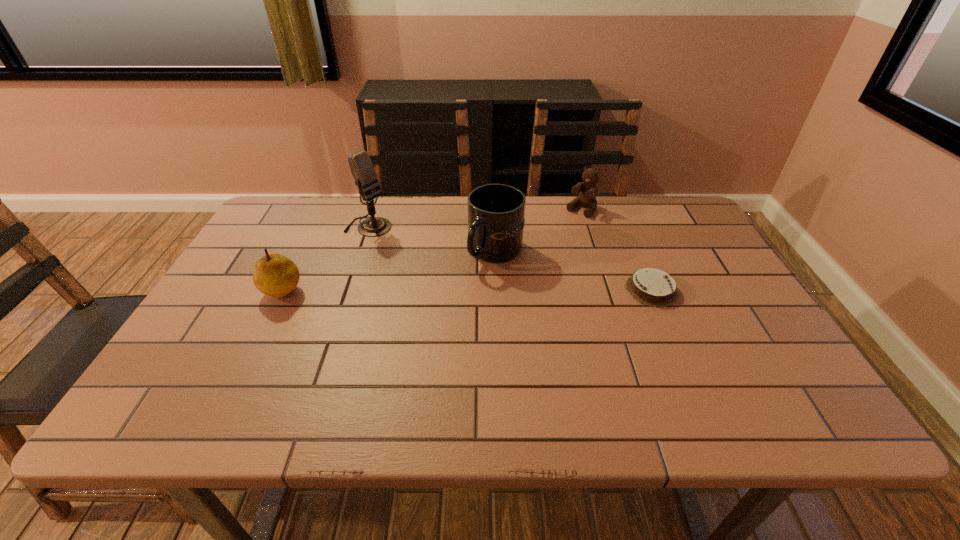
Find the location of a particular element. This screenshot has height=540, width=960. vacant space on the desktop that is between the leftmost object and the shortest object and is positioned with the handle on the side of the fourth shortest object is located at coordinates (427, 288).

The height and width of the screenshot is (540, 960). Identify the location of free spot on the desktop that is between the pear and the shortest object and is positioned on the face of the teddy bear. (500, 288).

Where is `vacant space on the desktop that is between the pear and the shortest object and is positioned on the front-facing side of the fourth object from right to left`? Image resolution: width=960 pixels, height=540 pixels. vacant space on the desktop that is between the pear and the shortest object and is positioned on the front-facing side of the fourth object from right to left is located at coordinates (482, 288).